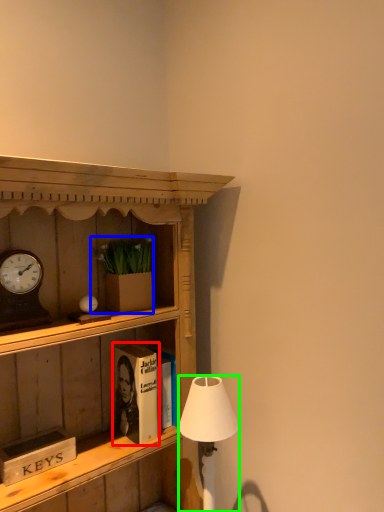
Question: Which object is positioned farthest from book (highlighted by a red box)? Select from houseplant (highlighted by a blue box) and lamp (highlighted by a green box).

Choices:
 (A) houseplant
 (B) lamp

Answer: (A)